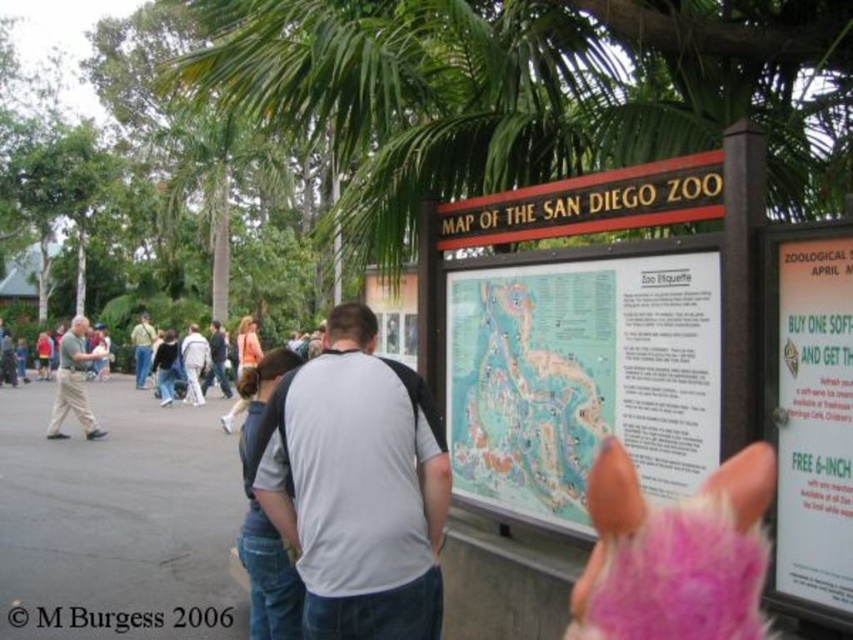
Question: Which of the following is the farthest from the observer?

Choices:
 (A) (276, 356)
 (B) (749, 588)
 (C) (258, 492)

Answer: (A)

Question: Is gray fabric shirt at center closer to camera compared to pink fluffy ears at center?

Choices:
 (A) no
 (B) yes

Answer: (B)

Question: Which object is positioned farthest from the pink fluffy ears at center?

Choices:
 (A) gray fabric backpack at center
 (B) gray fabric shirt at center
 (C) light gray cotton shirt at left
 (D) map of san diego zoo at center

Answer: (C)

Question: Is gray fabric backpack at center thinner than light gray cotton shirt at left?

Choices:
 (A) yes
 (B) no

Answer: (A)

Question: Which point is farther from the camera taking this photo?

Choices:
 (A) (540, 324)
 (B) (677, 595)
 (C) (299, 404)

Answer: (A)

Question: Does white paper sign at right have a smaller size compared to light gray cotton shirt at left?

Choices:
 (A) yes
 (B) no

Answer: (A)